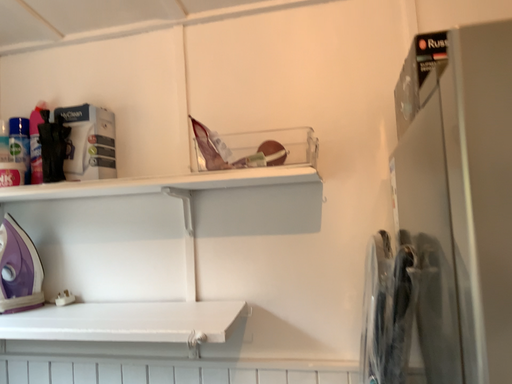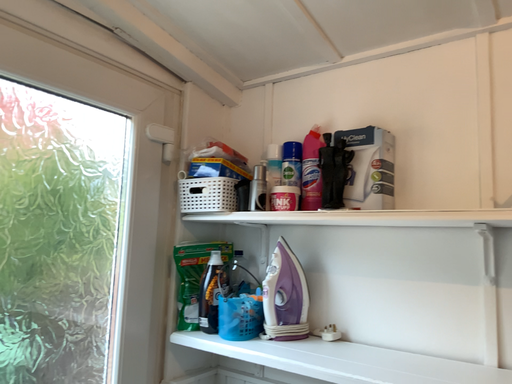
Question: Which way did the camera rotate in the video?

Choices:
 (A) rotated left
 (B) rotated right

Answer: (A)